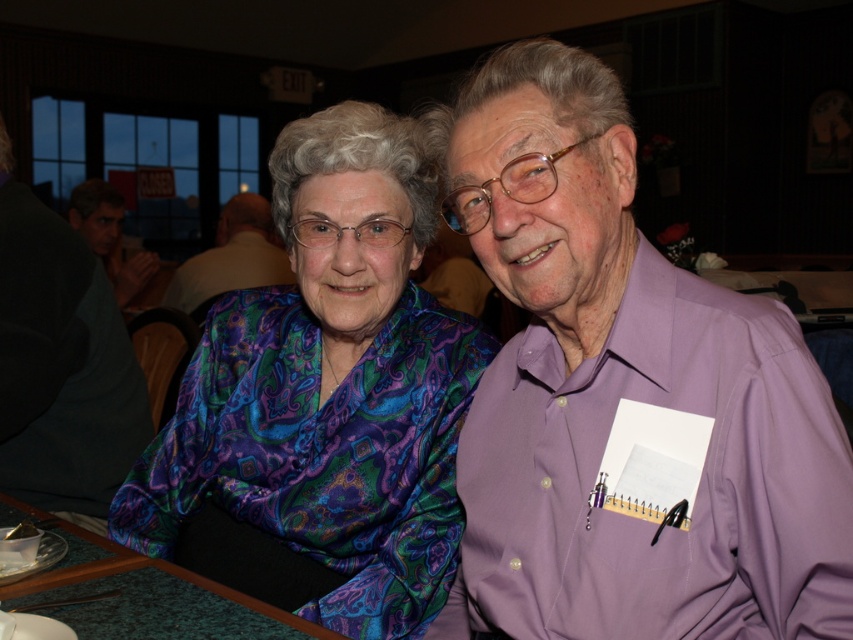
Question: Which object appears farthest from the camera in this image?

Choices:
 (A) purple smooth shirt at right
 (B) purple satin shirt at upper right

Answer: (B)

Question: Does purple smooth shirt at right appear over purple satin shirt at upper right?

Choices:
 (A) no
 (B) yes

Answer: (A)

Question: Does green felt table at lower left come in front of purple satin shirt at upper right?

Choices:
 (A) yes
 (B) no

Answer: (A)

Question: Estimate the real-world distances between objects in this image. Which object is farther from the matte black shirt at upper left?

Choices:
 (A) green felt table at lower left
 (B) purple satin shirt at upper right

Answer: (A)

Question: Which point is closer to the camera?

Choices:
 (A) purple satin shirt at upper right
 (B) multicolored paisley blouse at center

Answer: (B)

Question: Is green felt table at lower left smaller than purple satin shirt at upper right?

Choices:
 (A) no
 (B) yes

Answer: (B)